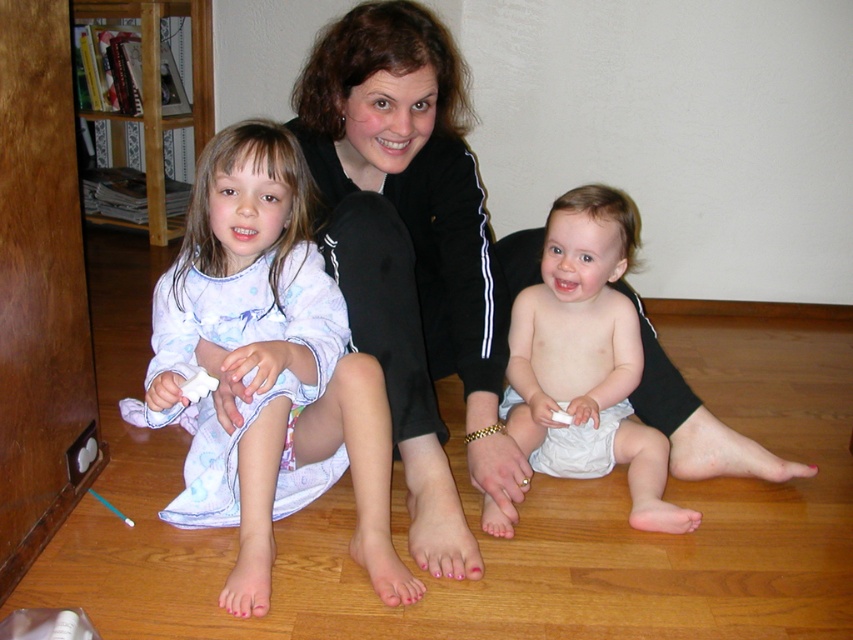
You are a parent trying to organize the room. You need to place a new toy box that is the same width as the white cloth diaper at center. Can the toy box fit on the wooden bookshelf at left without exceeding its width? Explain your reasoning.

The wooden bookshelf at left is wider than the white cloth diaper at center. Since the toy box has the same width as the diaper, it will fit on the wooden bookshelf at left without exceeding its width.